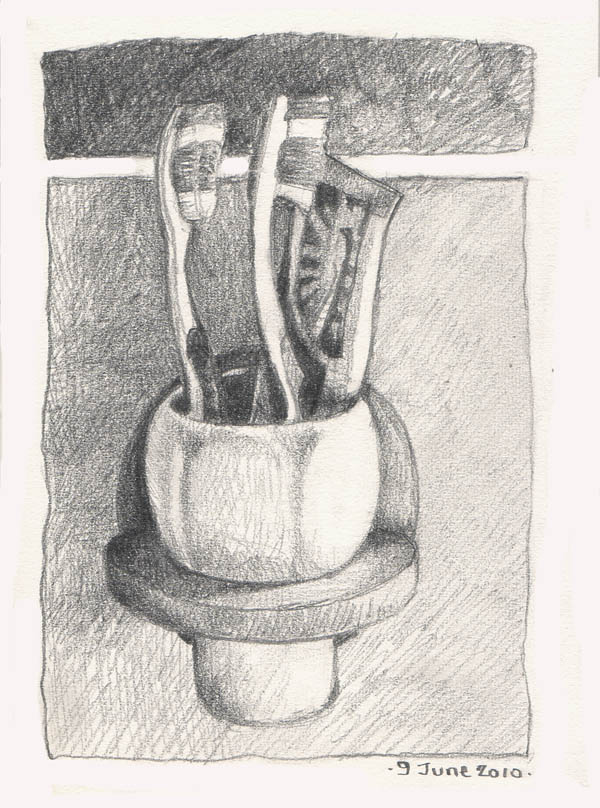
Where is `cup`? This screenshot has width=600, height=808. cup is located at coordinates (x=283, y=560).